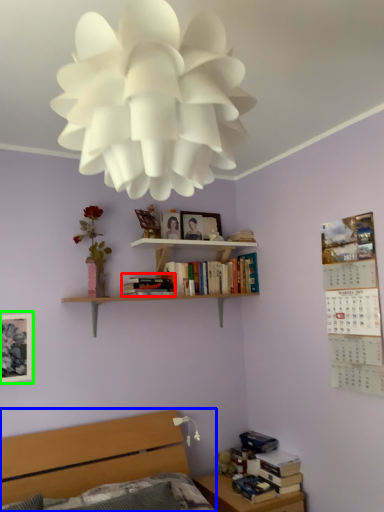
Question: Estimate the real-world distances between objects in this image. Which object is farther from book (highlighted by a red box), bed (highlighted by a blue box) or picture frame (highlighted by a green box)?

Choices:
 (A) bed
 (B) picture frame

Answer: (A)